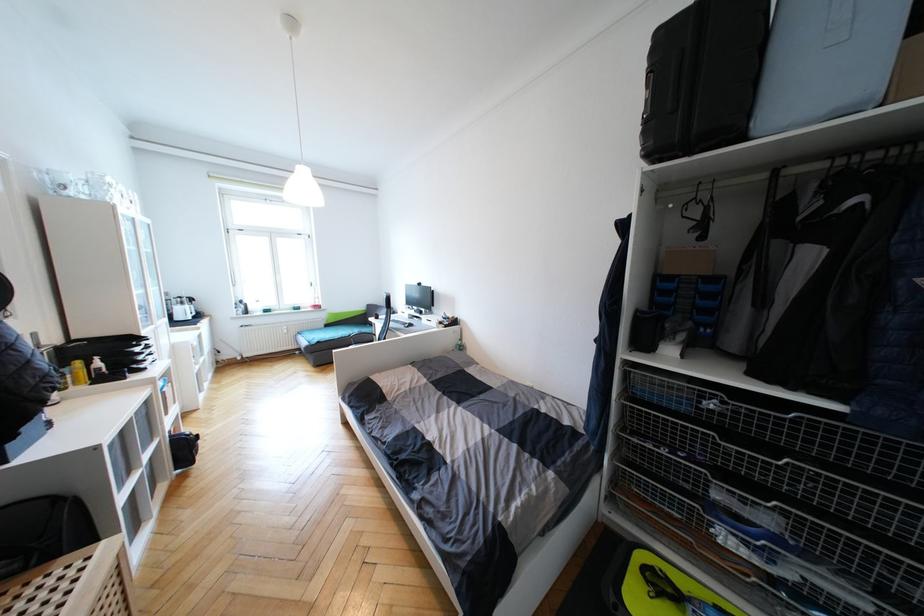
Identify the location of blue mailer bag. (825, 61).